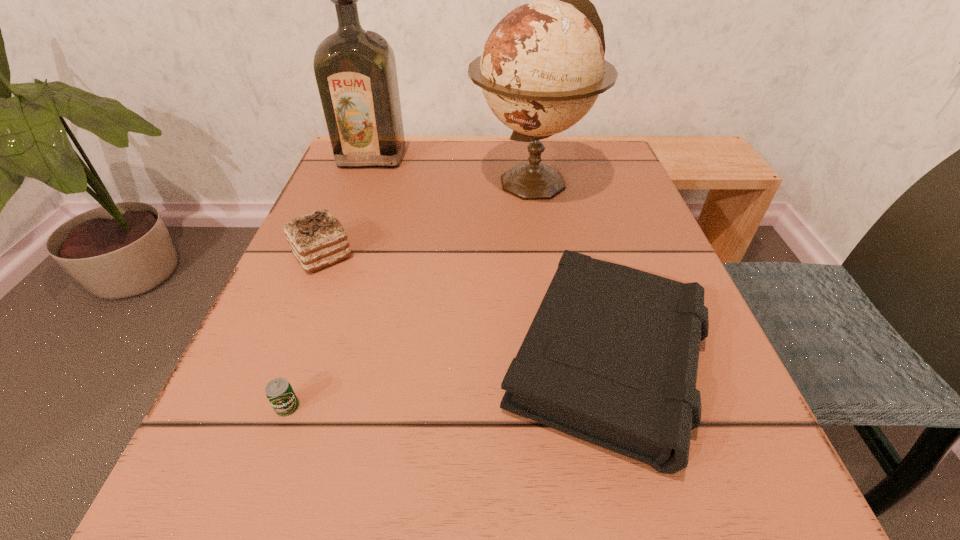
You are a GUI agent. You are given a task and a screenshot of the screen. Output one action in this format:
    pyautogui.click(x=<x>, y=<y>)
    Task: Click on the free space located on the left of the Bible
    
    Given the screenshot: What is the action you would take?
    pyautogui.click(x=300, y=361)

What are the coordinates of `free location located 0.070m on the front of the shortest object` in the screenshot? It's located at (260, 482).

Where is `globe that is at the far edge`? globe that is at the far edge is located at coordinates (542, 68).

I want to click on liquor at the far edge, so click(x=355, y=70).

The height and width of the screenshot is (540, 960). Find the location of `object situated at the near edge`. object situated at the near edge is located at coordinates (611, 357).

Image resolution: width=960 pixels, height=540 pixels. I want to click on liquor at the left edge, so click(x=355, y=70).

Locate an element on the screen. Image resolution: width=960 pixels, height=540 pixels. chocolate cake that is at the left edge is located at coordinates (317, 240).

At what (x,y) coordinates should I click in order to perform the action: click on beer can that is at the left edge. Please return your answer as a coordinate pair (x, y). The height and width of the screenshot is (540, 960). Looking at the image, I should click on (279, 391).

What are the coordinates of `globe located in the right edge section of the desktop` in the screenshot? It's located at pyautogui.click(x=542, y=68).

Locate an element on the screen. Bible present at the right edge is located at coordinates (611, 357).